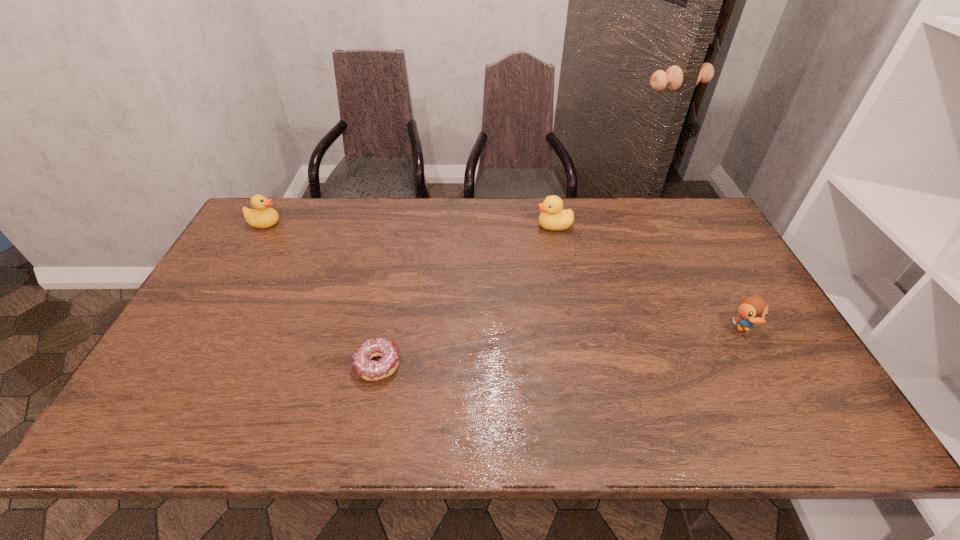
Image resolution: width=960 pixels, height=540 pixels. I want to click on vacant space located on the front-facing side of the third farthest object, so click(x=772, y=382).

You are a GUI agent. You are given a task and a screenshot of the screen. Output one action in this format:
    pyautogui.click(x=<x>, y=<y>)
    Task: Click on the vacant space located on the front of the doughnut
    Image resolution: width=960 pixels, height=540 pixels.
    Given the screenshot: What is the action you would take?
    pyautogui.click(x=370, y=405)

Locate an element on the screen. object positioned at the left edge is located at coordinates (263, 216).

Image resolution: width=960 pixels, height=540 pixels. I want to click on object situated at the right edge, so click(752, 309).

This screenshot has width=960, height=540. I want to click on object positioned at the far left corner, so 263,216.

You are a GUI agent. You are given a task and a screenshot of the screen. Output one action in this format:
    pyautogui.click(x=<x>, y=<y>)
    Task: Click on the vacant area at the far edge of the desktop
    Image resolution: width=960 pixels, height=540 pixels.
    Given the screenshot: What is the action you would take?
    pyautogui.click(x=515, y=210)

The height and width of the screenshot is (540, 960). I want to click on free spot at the near edge of the desktop, so click(x=722, y=428).

This screenshot has height=540, width=960. Identify the location of vacant space at the left edge of the desktop. (239, 281).

This screenshot has width=960, height=540. In the image, there is a desktop. Find the location of `vacant space at the right edge`. vacant space at the right edge is located at coordinates (700, 245).

In the image, there is a desktop. Where is `free space at the far left corner`? free space at the far left corner is located at coordinates (248, 240).